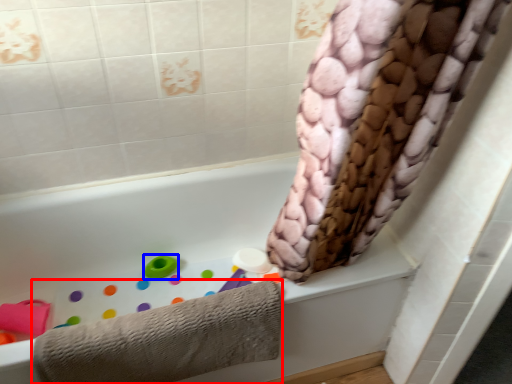
Question: Which object appears closest to the camera in this image, towel (highlighted by a red box) or toy (highlighted by a blue box)?

Choices:
 (A) towel
 (B) toy

Answer: (A)